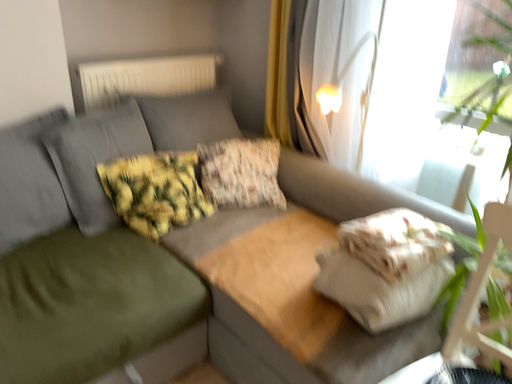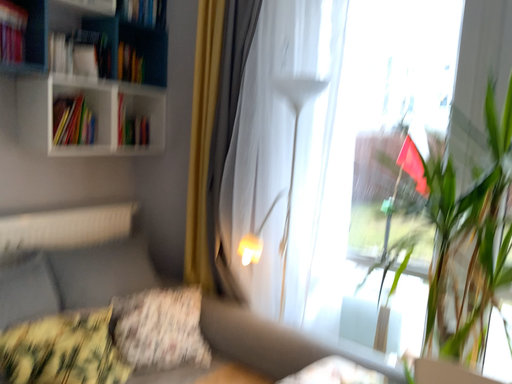
Question: How did the camera likely rotate when shooting the video?

Choices:
 (A) rotated right
 (B) rotated left

Answer: (A)